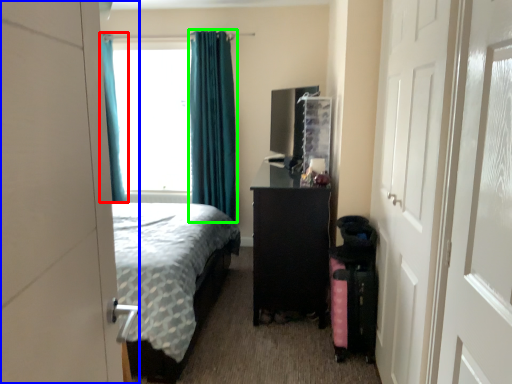
Question: Estimate the real-world distances between objects in this image. Which object is closer to curtain (highlighted by a red box), door (highlighted by a blue box) or curtain (highlighted by a green box)?

Choices:
 (A) door
 (B) curtain

Answer: (B)